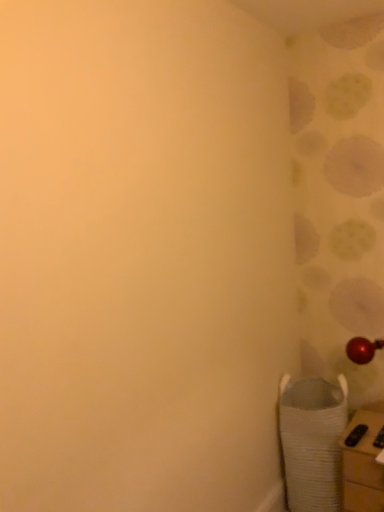
Question: Is white cardboard box at lower right to the left or to the right of white woven laundry basket at lower right in the image?

Choices:
 (A) left
 (B) right

Answer: (B)

Question: Is white cardboard box at lower right taller or shorter than white woven laundry basket at lower right?

Choices:
 (A) tall
 (B) short

Answer: (B)

Question: In terms of size, does white cardboard box at lower right appear bigger or smaller than white woven laundry basket at lower right?

Choices:
 (A) small
 (B) big

Answer: (A)

Question: Looking at the image, does white woven laundry basket at lower right seem bigger or smaller compared to white cardboard box at lower right?

Choices:
 (A) small
 (B) big

Answer: (B)

Question: In the image, is white woven laundry basket at lower right positioned in front of or behind white cardboard box at lower right?

Choices:
 (A) front
 (B) behind

Answer: (B)

Question: Choose the correct answer: Is white woven laundry basket at lower right inside white cardboard box at lower right or outside it?

Choices:
 (A) outside
 (B) inside

Answer: (A)

Question: Based on their positions, is white woven laundry basket at lower right located to the left or right of white cardboard box at lower right?

Choices:
 (A) right
 (B) left

Answer: (B)